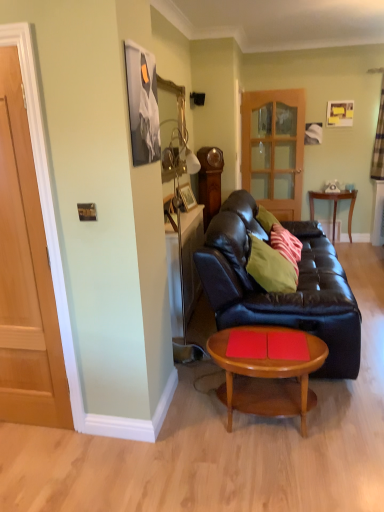
You are a GUI agent. You are given a task and a screenshot of the screen. Output one action in this format:
    pyautogui.click(x=<x>, y=<y>)
    Task: Click on the blank space above light brown wooden coffee table at center (from a real-world perspective)
    Image resolution: width=384 pixels, height=512 pixels.
    Given the screenshot: What is the action you would take?
    pyautogui.click(x=266, y=345)